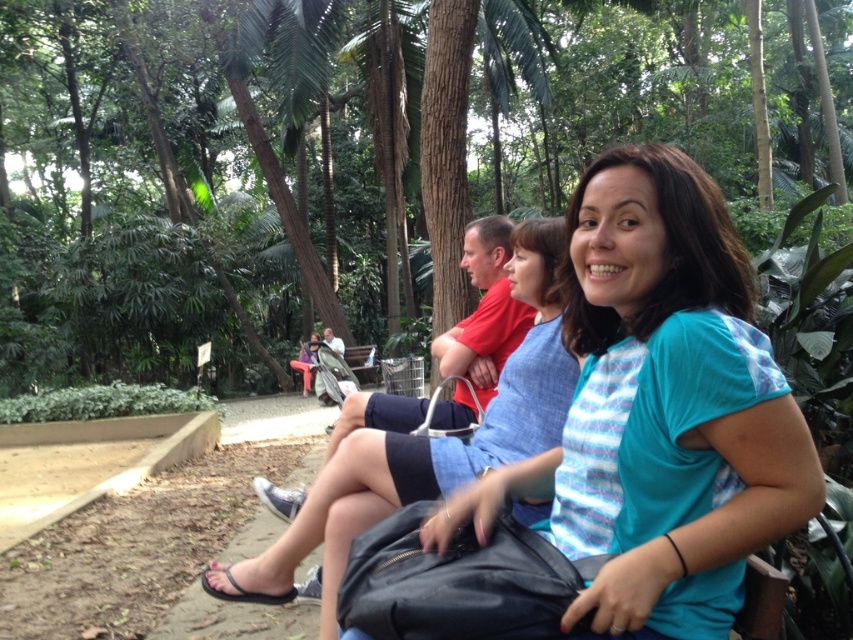
You are standing at the edge of the park and want to take a photo of the green leafy tree at center and the matte blue shirt at center. Which object should you zoom in on to capture both in the frame without moving your camera?

The green leafy tree at center is larger than the matte blue shirt at center, so you should zoom in on the matte blue shirt at center to include both in the frame without moving the camera.

You are standing at the origin point of the coordinate system in this park scene. The green leafy tree at center is located at coordinates 0.253 in the x direction and 0.363 in the y direction. If you want to walk directly towards the tree, which direction should you move first? Please provide your answer in terms of compass directions like north, south, east, or west.

Since the green leafy tree at center is located at coordinates x 0.253 and y 0.363, you should move east first because the x coordinate is positive, indicating eastward direction from the origin.

You are standing at the point marked by coordinates point (309,161). Looking around, you see a green leafy tree at center. Which direction should you walk to reach the paved pathway?

The point (309,161) marks the green leafy tree at center. Since the paved pathway runs through the scene, you should walk towards the direction where the pathway is located, which is away from the tree towards the lower part of the image.